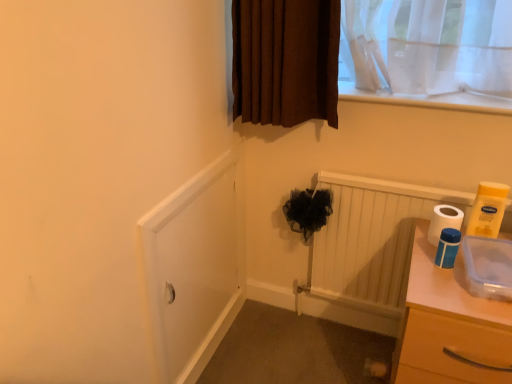
At what (x,y) coordinates should I click in order to perform the action: click on free location in front of white matte toilet paper at right, which ranks as the second toilet paper in right-to-left order. Please return your answer as a coordinate pair (x, y). The height and width of the screenshot is (384, 512). Looking at the image, I should click on (441, 282).